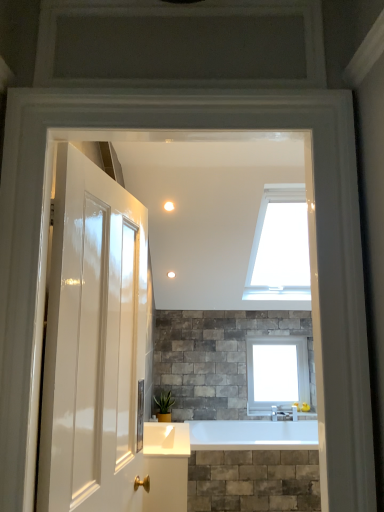
Question: Considering the relative positions of white glass window at center and green glossy plant at center in the image provided, is white glass window at center to the left or to the right of green glossy plant at center?

Choices:
 (A) right
 (B) left

Answer: (A)

Question: Is white glass window at center in front of or behind green glossy plant at center in the image?

Choices:
 (A) front
 (B) behind

Answer: (B)

Question: In terms of size, does white glass window at center appear bigger or smaller than green glossy plant at center?

Choices:
 (A) small
 (B) big

Answer: (B)

Question: Is green glossy plant at center inside or outside of white glass window at center?

Choices:
 (A) inside
 (B) outside

Answer: (B)

Question: From a real-world perspective, is green glossy plant at center physically located above or below white glass window at center?

Choices:
 (A) above
 (B) below

Answer: (B)

Question: From the image's perspective, relative to white glass window at center, is green glossy plant at center above or below?

Choices:
 (A) above
 (B) below

Answer: (B)

Question: Considering their positions, is green glossy plant at center located in front of or behind white glass window at center?

Choices:
 (A) front
 (B) behind

Answer: (A)